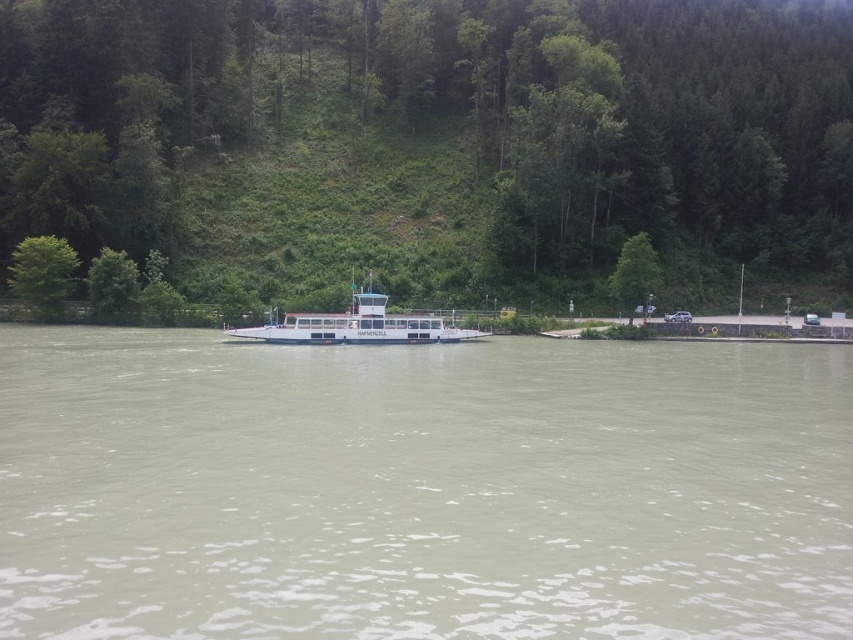
Question: Among these points, which one is farthest from the camera?

Choices:
 (A) (67, 243)
 (B) (637, 305)
 (C) (744, 33)
 (D) (309, 317)

Answer: (C)

Question: Which of the following is the farthest from the observer?

Choices:
 (A) white glossy boat at center
 (B) green leafy tree at center
 (C) green leafy tree at upper left
 (D) brown murky water at center

Answer: (B)

Question: Considering the relative positions of brown murky water at center and white glossy boat at center in the image provided, where is brown murky water at center located with respect to white glossy boat at center?

Choices:
 (A) above
 (B) below

Answer: (B)

Question: Which object appears farthest from the camera in this image?

Choices:
 (A) green leafy tree at upper left
 (B) brown murky water at center
 (C) green leafy tree at right

Answer: (A)

Question: Is green leafy tree at upper left positioned at the back of green leafy tree at right?

Choices:
 (A) yes
 (B) no

Answer: (A)

Question: Can you confirm if brown murky water at center is positioned to the right of green leafy tree at center?

Choices:
 (A) no
 (B) yes

Answer: (A)